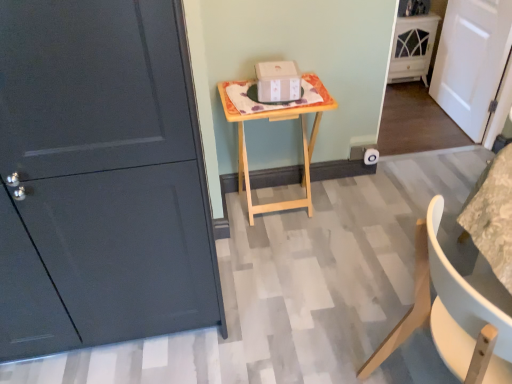
Where is `free space above natural wood table at center (from a real-world perspective)`? This screenshot has height=384, width=512. free space above natural wood table at center (from a real-world perspective) is located at coordinates (260, 99).